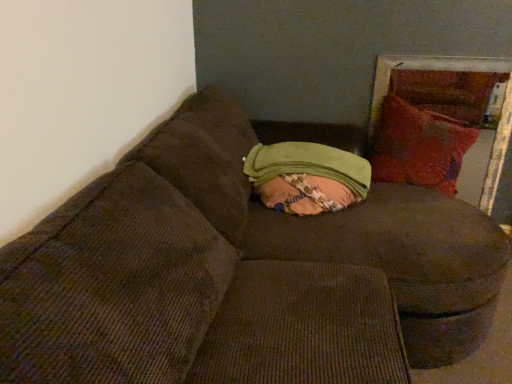
What is the approximate height of green fabric bean bag at center?

green fabric bean bag at center is 8.93 inches in height.

This screenshot has height=384, width=512. What do you see at coordinates (306, 177) in the screenshot?
I see `green fabric bean bag at center` at bounding box center [306, 177].

Image resolution: width=512 pixels, height=384 pixels. In order to click on green fabric bean bag at center in this screenshot , I will do `click(306, 177)`.

The height and width of the screenshot is (384, 512). What do you see at coordinates (419, 146) in the screenshot? I see `velvet red pillow at right` at bounding box center [419, 146].

Measure the distance between point (466, 147) and camera.

Point (466, 147) is 2.23 meters from camera.

At what (x,y) coordinates should I click in order to perform the action: click on velvet red pillow at right. Please return your answer as a coordinate pair (x, y). This screenshot has width=512, height=384. Looking at the image, I should click on (419, 146).

Locate an element on the screen. The image size is (512, 384). green fabric bean bag at center is located at coordinates (306, 177).

Considering the positions of objects velvet red pillow at right and green fabric bean bag at center in the image provided, who is more to the left, velvet red pillow at right or green fabric bean bag at center?

From the viewer's perspective, green fabric bean bag at center appears more on the left side.

Is the position of velvet red pillow at right less distant than that of green fabric bean bag at center?

No, velvet red pillow at right is behind green fabric bean bag at center.

Between point (404, 122) and point (276, 203), which one is positioned in front?

The point (276, 203) is more forward.

From the image's perspective, who appears lower, velvet red pillow at right or green fabric bean bag at center?

From the image's view, green fabric bean bag at center is below.

From a real-world perspective, between velvet red pillow at right and green fabric bean bag at center, who is vertically lower?

green fabric bean bag at center.

Does velvet red pillow at right have a greater width compared to green fabric bean bag at center?

Incorrect, the width of velvet red pillow at right does not surpass that of green fabric bean bag at center.

Is velvet red pillow at right taller than green fabric bean bag at center?

Yes.

Does velvet red pillow at right have a smaller size compared to green fabric bean bag at center?

Incorrect, velvet red pillow at right is not smaller in size than green fabric bean bag at center.

In the scene shown: Do you think velvet red pillow at right is within green fabric bean bag at center, or outside of it?

velvet red pillow at right exists outside the volume of green fabric bean bag at center.

Is velvet red pillow at right far from green fabric bean bag at center?

No.

Is velvet red pillow at right oriented towards green fabric bean bag at center?

No, velvet red pillow at right is not aimed at green fabric bean bag at center.

Where is `bean bag chair below the velvet red pillow at right (from the image's perspective)`? The image size is (512, 384). bean bag chair below the velvet red pillow at right (from the image's perspective) is located at coordinates (306, 177).

Is green fabric bean bag at center at the right side of velvet red pillow at right?

Incorrect, green fabric bean bag at center is not on the right side of velvet red pillow at right.

Is green fabric bean bag at center in front of or behind velvet red pillow at right in the image?

Clearly, green fabric bean bag at center is in front of velvet red pillow at right.

Between point (310, 167) and point (424, 115), which one is positioned in front?

The point (310, 167) is closer to the camera.

From the image's perspective, is green fabric bean bag at center on velvet red pillow at right?

No.

From a real-world perspective, which is physically above, green fabric bean bag at center or velvet red pillow at right?

velvet red pillow at right is physically above.

In terms of width, does green fabric bean bag at center look wider or thinner when compared to velvet red pillow at right?

In the image, green fabric bean bag at center appears to be wider than velvet red pillow at right.

Who is shorter, green fabric bean bag at center or velvet red pillow at right?

green fabric bean bag at center.

Which of these two, green fabric bean bag at center or velvet red pillow at right, is smaller?

Smaller between the two is green fabric bean bag at center.

Based on the photo, is green fabric bean bag at center located outside velvet red pillow at right?

Yes, green fabric bean bag at center is located beyond the bounds of velvet red pillow at right.

Would you say green fabric bean bag at center is a long distance from velvet red pillow at right?

That's not correct — green fabric bean bag at center is a little close to velvet red pillow at right.

Is green fabric bean bag at center facing away from velvet red pillow at right?

green fabric bean bag at center does not have its back to velvet red pillow at right.

Can you tell me how much green fabric bean bag at center and velvet red pillow at right differ in facing direction?

The angular difference between green fabric bean bag at center and velvet red pillow at right is 94 degrees.

In the image, there is a velvet red pillow at right. Find the location of `bean bag chair below it (from the image's perspective)`. bean bag chair below it (from the image's perspective) is located at coordinates (306, 177).

The image size is (512, 384). I want to click on throw pillow above the green fabric bean bag at center (from a real-world perspective), so click(x=419, y=146).

In the image, there is a velvet red pillow at right. Where is `bean bag chair below it (from the image's perspective)`? bean bag chair below it (from the image's perspective) is located at coordinates (306, 177).